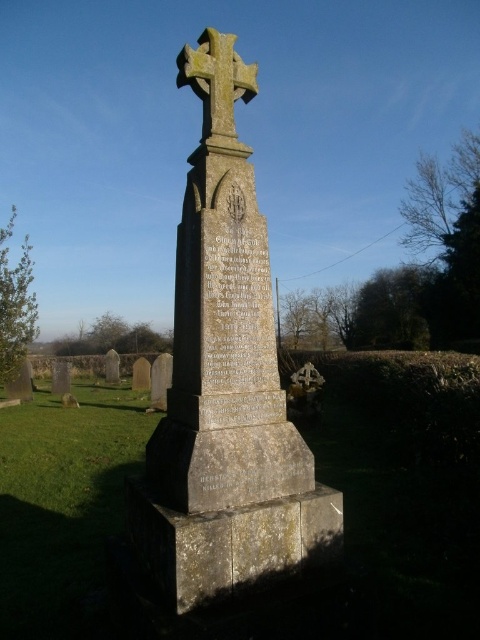
Can you confirm if stone cross at center is positioned below yellow stone cross at center?

Yes.

Is stone cross at center bigger than yellow stone cross at center?

Yes.

Is point (310, 454) positioned behind point (217, 109)?

No.

The image size is (480, 640). I want to click on stone cross at center, so click(x=226, y=384).